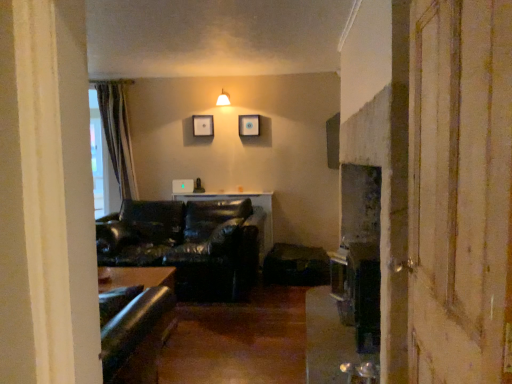
This screenshot has height=384, width=512. What do you see at coordinates (249, 125) in the screenshot? I see `wooden picture frame at upper center, arranged as the 2th picture frame when viewed from the left` at bounding box center [249, 125].

Describe the element at coordinates (203, 125) in the screenshot. Image resolution: width=512 pixels, height=384 pixels. I see `matte black picture frame at upper center, which ranks as the second picture frame in right-to-left order` at that location.

The height and width of the screenshot is (384, 512). What do you see at coordinates (460, 192) in the screenshot? I see `wooden screen door at right` at bounding box center [460, 192].

Describe the element at coordinates (223, 99) in the screenshot. I see `matte white lampshade at upper center` at that location.

You are a GUI agent. You are given a task and a screenshot of the screen. Output one action in this format:
    pyautogui.click(x=<x>, y=<y>)
    Task: Click on the wooden picture frame at upper center, which ranks as the 1th picture frame in right-to-left order
    The height and width of the screenshot is (384, 512).
    Given the screenshot: What is the action you would take?
    [249, 125]

Is matte black picture frame at upper center, which ranks as the second picture frame in right-to-left order, far from green striped curtain at left?

Yes, matte black picture frame at upper center, which ranks as the second picture frame in right-to-left order, is far from green striped curtain at left.

Considering the relative sizes of matte black picture frame at upper center, the 1th picture frame from the left, and green striped curtain at left in the image provided, is matte black picture frame at upper center, the 1th picture frame from the left, shorter than green striped curtain at left?

Yes.

Is the position of matte black picture frame at upper center, the 1th picture frame from the left, less distant than that of green striped curtain at left?

That is False.

Is matte black picture frame at upper center, which ranks as the second picture frame in right-to-left order, positioned with its back to wooden picture frame at upper center, which ranks as the 1th picture frame in right-to-left order?

No.

Locate an element on the screen. This screenshot has height=384, width=512. picture frame behind the wooden picture frame at upper center, arranged as the 2th picture frame when viewed from the left is located at coordinates (203, 125).

Does point (201, 122) appear closer or farther from the camera than point (247, 121)?

Clearly, point (201, 122) is more distant from the camera than point (247, 121).

Is matte black picture frame at upper center, which ranks as the second picture frame in right-to-left order, shorter than wooden picture frame at upper center, arranged as the 2th picture frame when viewed from the left?

No, matte black picture frame at upper center, which ranks as the second picture frame in right-to-left order, is not shorter than wooden picture frame at upper center, arranged as the 2th picture frame when viewed from the left.

Does point (134, 178) come farther from viewer compared to point (223, 92)?

Yes, point (134, 178) is behind point (223, 92).

How different are the orientations of green striped curtain at left and matte white lampshade at upper center in degrees?

0.00408 degrees separate the facing orientations of green striped curtain at left and matte white lampshade at upper center.

Based on their positions, is green striped curtain at left located to the left or right of matte white lampshade at upper center?

In the image, green striped curtain at left appears on the left side of matte white lampshade at upper center.

Where is `the 1st picture frame to the left when counting from the wooden screen door at right`? Image resolution: width=512 pixels, height=384 pixels. the 1st picture frame to the left when counting from the wooden screen door at right is located at coordinates (249, 125).

From the image's perspective, does wooden screen door at right appear lower than wooden picture frame at upper center, which ranks as the 1th picture frame in right-to-left order?

Yes.

Which of these two, wooden screen door at right or wooden picture frame at upper center, which ranks as the 1th picture frame in right-to-left order, is wider?

wooden screen door at right is wider.

Is wooden screen door at right aimed at wooden picture frame at upper center, arranged as the 2th picture frame when viewed from the left?

No, wooden screen door at right is not turned towards wooden picture frame at upper center, arranged as the 2th picture frame when viewed from the left.

Is leather couch at center at the right side of matte black picture frame at upper center, which ranks as the second picture frame in right-to-left order?

Incorrect, leather couch at center is not on the right side of matte black picture frame at upper center, which ranks as the second picture frame in right-to-left order.

Considering the sizes of objects leather couch at center and matte black picture frame at upper center, which ranks as the second picture frame in right-to-left order, in the image provided, who is smaller, leather couch at center or matte black picture frame at upper center, which ranks as the second picture frame in right-to-left order,?

matte black picture frame at upper center, which ranks as the second picture frame in right-to-left order, is smaller.

From the picture: Is leather couch at center behind matte black picture frame at upper center, which ranks as the second picture frame in right-to-left order?

That is False.

Is matte black picture frame at upper center, which ranks as the second picture frame in right-to-left order, located within leather couch at center?

No, matte black picture frame at upper center, which ranks as the second picture frame in right-to-left order, is not a part of leather couch at center.

Considering the positions of point (198, 126) and point (119, 245), is point (198, 126) closer or farther from the camera than point (119, 245)?

Clearly, point (198, 126) is more distant from the camera than point (119, 245).

Does matte black picture frame at upper center, the 1th picture frame from the left, have a lesser width compared to leather couch at center?

Correct, the width of matte black picture frame at upper center, the 1th picture frame from the left, is less than that of leather couch at center.

What's the angular difference between matte black picture frame at upper center, which ranks as the second picture frame in right-to-left order, and leather couch at center's facing directions?

0.586 degrees separate the facing orientations of matte black picture frame at upper center, which ranks as the second picture frame in right-to-left order, and leather couch at center.

Considering the relative positions of wooden picture frame at upper center, which ranks as the 1th picture frame in right-to-left order, and matte black picture frame at upper center, the 1th picture frame from the left, in the image provided, is wooden picture frame at upper center, which ranks as the 1th picture frame in right-to-left order, to the left of matte black picture frame at upper center, the 1th picture frame from the left, from the viewer's perspective?

In fact, wooden picture frame at upper center, which ranks as the 1th picture frame in right-to-left order, is to the right of matte black picture frame at upper center, the 1th picture frame from the left.

Considering the relative sizes of wooden picture frame at upper center, which ranks as the 1th picture frame in right-to-left order, and matte black picture frame at upper center, the 1th picture frame from the left, in the image provided, is wooden picture frame at upper center, which ranks as the 1th picture frame in right-to-left order, wider than matte black picture frame at upper center, the 1th picture frame from the left,?

Indeed, wooden picture frame at upper center, which ranks as the 1th picture frame in right-to-left order, has a greater width compared to matte black picture frame at upper center, the 1th picture frame from the left.

From the picture: Is the surface of wooden picture frame at upper center, which ranks as the 1th picture frame in right-to-left order, in direct contact with matte black picture frame at upper center, the 1th picture frame from the left?

No.

From the picture: From the image's perspective, would you say wooden picture frame at upper center, arranged as the 2th picture frame when viewed from the left, is positioned over matte black picture frame at upper center, which ranks as the second picture frame in right-to-left order?

No.

Starting from the green striped curtain at left, which picture frame is the 2nd one behind? Please provide its 2D coordinates.

[(203, 125)]

This screenshot has height=384, width=512. I want to click on picture frame lying below the matte black picture frame at upper center, the 1th picture frame from the left (from the image's perspective), so click(249, 125).

Based on their spatial positions, is leather couch at center or wooden screen door at right closer to matte black picture frame at upper center, which ranks as the second picture frame in right-to-left order?

The object closer to matte black picture frame at upper center, which ranks as the second picture frame in right-to-left order, is leather couch at center.

Estimate the real-world distances between objects in this image. Which object is further from leather couch at center, wooden screen door at right or matte black picture frame at upper center, the 1th picture frame from the left?

wooden screen door at right.

Estimate the real-world distances between objects in this image. Which object is further from green striped curtain at left, wooden picture frame at upper center, arranged as the 2th picture frame when viewed from the left, or matte white lampshade at upper center?

wooden picture frame at upper center, arranged as the 2th picture frame when viewed from the left.

When comparing their distances from leather couch at center, does matte white lampshade at upper center or wooden picture frame at upper center, arranged as the 2th picture frame when viewed from the left, seem further?

matte white lampshade at upper center is positioned further to the anchor leather couch at center.

From the image, which object appears to be nearer to matte white lampshade at upper center, wooden screen door at right or green striped curtain at left?

Based on the image, green striped curtain at left appears to be nearer to matte white lampshade at upper center.

When comparing their distances from matte white lampshade at upper center, does wooden picture frame at upper center, which ranks as the 1th picture frame in right-to-left order, or leather couch at center seem further?

Among the two, leather couch at center is located further to matte white lampshade at upper center.

Which object lies nearer to the anchor point wooden screen door at right, green striped curtain at left or leather couch at center?

leather couch at center lies closer to wooden screen door at right than the other object.

Estimate the real-world distances between objects in this image. Which object is further from wooden screen door at right, wooden picture frame at upper center, arranged as the 2th picture frame when viewed from the left, or matte white lampshade at upper center?

Based on the image, matte white lampshade at upper center appears to be further to wooden screen door at right.

Find the location of a particular element. The width and height of the screenshot is (512, 384). light fixture between wooden screen door at right and wooden picture frame at upper center, arranged as the 2th picture frame when viewed from the left, along the z-axis is located at coordinates (223, 99).

I want to click on curtain between leather couch at center and matte black picture frame at upper center, which ranks as the second picture frame in right-to-left order, from front to back, so click(117, 135).

Locate an element on the screen. curtain between matte white lampshade at upper center and leather couch at center in the up-down direction is located at coordinates (117, 135).

Locate an element on the screen. Image resolution: width=512 pixels, height=384 pixels. studio couch positioned between wooden screen door at right and wooden picture frame at upper center, arranged as the 2th picture frame when viewed from the left, from near to far is located at coordinates [187, 244].